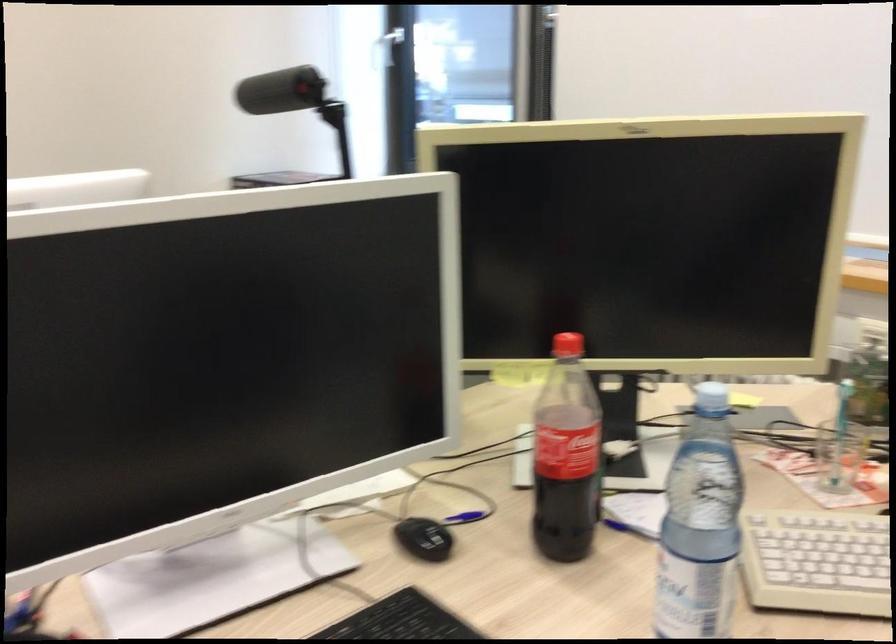
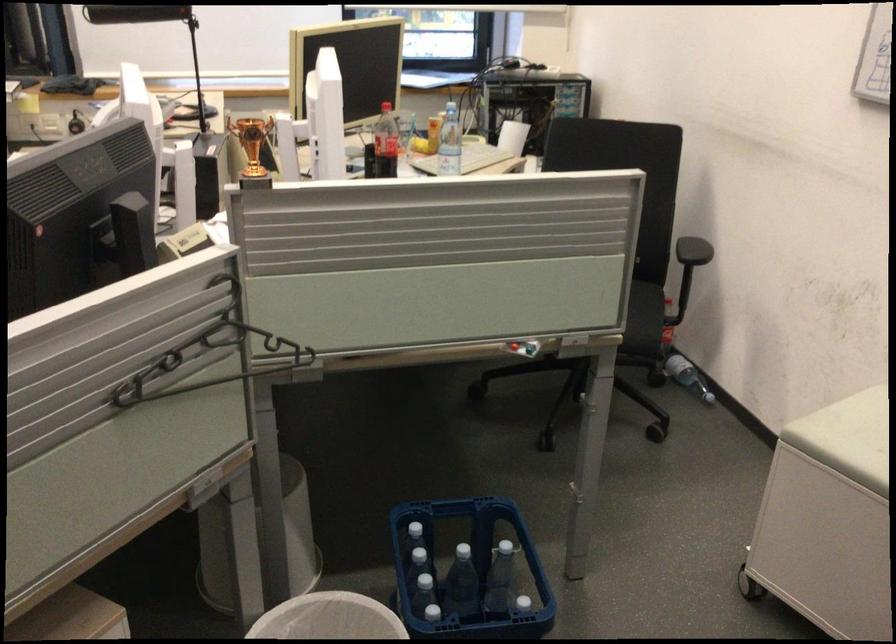
Locate, in the second image, the point that corresponds to (x=711, y=398) in the first image.

(440, 102)